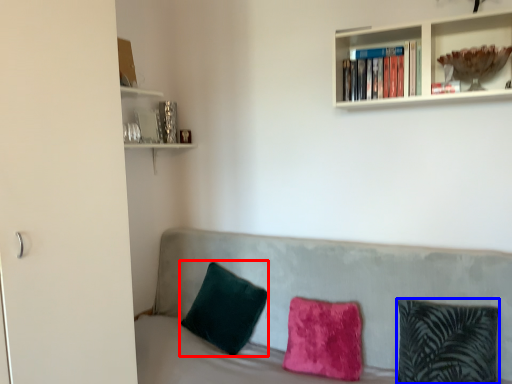
Question: Which object appears closest to the camera in this image, pillow (highlighted by a red box) or pillow (highlighted by a blue box)?

Choices:
 (A) pillow
 (B) pillow

Answer: (B)